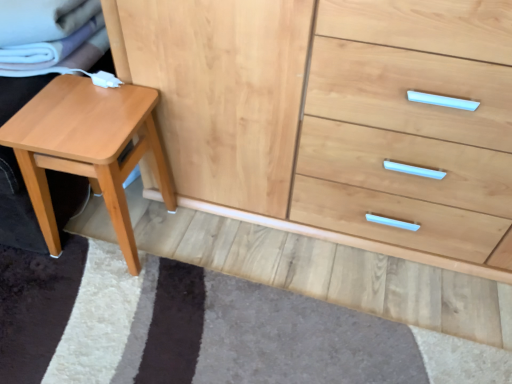
Locate an element on the screen. Image resolution: width=512 pixels, height=384 pixels. light brown wood stool at left is located at coordinates (88, 149).

This screenshot has width=512, height=384. What do you see at coordinates (88, 149) in the screenshot?
I see `light brown wood stool at left` at bounding box center [88, 149].

Image resolution: width=512 pixels, height=384 pixels. Describe the element at coordinates (335, 117) in the screenshot. I see `natural wood chest of drawers at center` at that location.

The image size is (512, 384). Find the location of `natural wood chest of drawers at center`. natural wood chest of drawers at center is located at coordinates pyautogui.click(x=335, y=117).

This screenshot has height=384, width=512. I want to click on light brown wood stool at left, so click(x=88, y=149).

Is light brown wood stool at left to the right of natural wood chest of drawers at center from the viewer's perspective?

Incorrect, light brown wood stool at left is not on the right side of natural wood chest of drawers at center.

Which object is further away from the camera taking this photo, light brown wood stool at left or natural wood chest of drawers at center?

light brown wood stool at left.

Is point (35, 125) positioned before point (314, 230)?

Yes.

From the image's perspective, is light brown wood stool at left located above or below natural wood chest of drawers at center?

Clearly, from the image's perspective, light brown wood stool at left is below natural wood chest of drawers at center.

From a real-world perspective, who is located higher, light brown wood stool at left or natural wood chest of drawers at center?

In real-world perspective, natural wood chest of drawers at center is above.

Which of these two, light brown wood stool at left or natural wood chest of drawers at center, is thinner?

light brown wood stool at left.

Considering the relative sizes of light brown wood stool at left and natural wood chest of drawers at center in the image provided, is light brown wood stool at left shorter than natural wood chest of drawers at center?

Indeed, light brown wood stool at left has a lesser height compared to natural wood chest of drawers at center.

Considering the relative sizes of light brown wood stool at left and natural wood chest of drawers at center in the image provided, is light brown wood stool at left bigger than natural wood chest of drawers at center?

Actually, light brown wood stool at left might be smaller than natural wood chest of drawers at center.

Is light brown wood stool at left inside the boundaries of natural wood chest of drawers at center, or outside?

The correct answer is: outside.

Is light brown wood stool at left positioned far away from natural wood chest of drawers at center?

light brown wood stool at left is near natural wood chest of drawers at center, not far away.

Is light brown wood stool at left aimed at natural wood chest of drawers at center?

No, light brown wood stool at left does not turn towards natural wood chest of drawers at center.

The width and height of the screenshot is (512, 384). In the image, there is a natural wood chest of drawers at center. Find the location of `stool below it (from a real-world perspective)`. stool below it (from a real-world perspective) is located at coordinates (88, 149).

Would you say natural wood chest of drawers at center is to the left or to the right of light brown wood stool at left in the picture?

Based on their positions, natural wood chest of drawers at center is located to the right of light brown wood stool at left.

Which object is more forward, natural wood chest of drawers at center or light brown wood stool at left?

natural wood chest of drawers at center is more forward.

Is point (380, 73) positioned behind point (113, 216)?

That is False.

In the scene shown: From the image's perspective, is natural wood chest of drawers at center above or below light brown wood stool at left?

From the image's perspective, natural wood chest of drawers at center appears above light brown wood stool at left.

From a real-world perspective, is natural wood chest of drawers at center positioned under light brown wood stool at left based on gravity?

Incorrect, from a real-world perspective, natural wood chest of drawers at center is higher than light brown wood stool at left.

Considering the sizes of objects natural wood chest of drawers at center and light brown wood stool at left in the image provided, who is thinner, natural wood chest of drawers at center or light brown wood stool at left?

With smaller width is light brown wood stool at left.

Who is shorter, natural wood chest of drawers at center or light brown wood stool at left?

light brown wood stool at left is shorter.

Based on their sizes in the image, would you say natural wood chest of drawers at center is bigger or smaller than light brown wood stool at left?

Clearly, natural wood chest of drawers at center is larger in size than light brown wood stool at left.

Is natural wood chest of drawers at center spatially inside light brown wood stool at left, or outside of it?

natural wood chest of drawers at center is located beyond the bounds of light brown wood stool at left.

Is there a large distance between natural wood chest of drawers at center and light brown wood stool at left?

natural wood chest of drawers at center is near light brown wood stool at left, not far away.

Is natural wood chest of drawers at center facing towards light brown wood stool at left?

Result: Yes, natural wood chest of drawers at center is facing light brown wood stool at left.

What's the angular difference between natural wood chest of drawers at center and light brown wood stool at left's facing directions?

1.71 degrees separate the facing orientations of natural wood chest of drawers at center and light brown wood stool at left.

This screenshot has width=512, height=384. Identify the location of chest of drawers above the light brown wood stool at left (from a real-world perspective). (335, 117).

Find the location of a particular element. The width and height of the screenshot is (512, 384). stool below the natural wood chest of drawers at center (from a real-world perspective) is located at coordinates (88, 149).

The image size is (512, 384). Identify the location of stool below the natural wood chest of drawers at center (from the image's perspective). (88, 149).